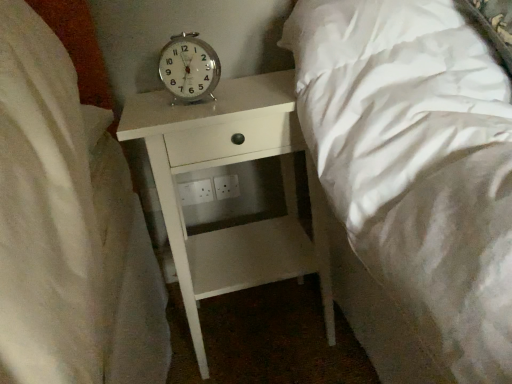
Question: Does metallic silver alarm clock at center have a lesser width compared to white matte nightstand at center?

Choices:
 (A) yes
 (B) no

Answer: (A)

Question: Does metallic silver alarm clock at center have a greater width compared to white matte nightstand at center?

Choices:
 (A) no
 (B) yes

Answer: (A)

Question: Is metallic silver alarm clock at center far from white matte nightstand at center?

Choices:
 (A) no
 (B) yes

Answer: (A)

Question: From the image's perspective, is metallic silver alarm clock at center beneath white matte nightstand at center?

Choices:
 (A) yes
 (B) no

Answer: (B)

Question: Is white matte nightstand at center inside metallic silver alarm clock at center?

Choices:
 (A) no
 (B) yes

Answer: (A)

Question: Is metallic silver alarm clock at center oriented towards white matte nightstand at center?

Choices:
 (A) no
 (B) yes

Answer: (A)

Question: Is white matte nightstand at center not within metallic silver alarm clock at center?

Choices:
 (A) yes
 (B) no

Answer: (A)

Question: Considering the relative sizes of white matte nightstand at center and metallic silver alarm clock at center in the image provided, is white matte nightstand at center taller than metallic silver alarm clock at center?

Choices:
 (A) yes
 (B) no

Answer: (A)

Question: Is white matte nightstand at center directly adjacent to metallic silver alarm clock at center?

Choices:
 (A) no
 (B) yes

Answer: (A)

Question: Is white matte nightstand at center aimed at metallic silver alarm clock at center?

Choices:
 (A) yes
 (B) no

Answer: (B)

Question: From a real-world perspective, is white matte nightstand at center over metallic silver alarm clock at center?

Choices:
 (A) yes
 (B) no

Answer: (B)

Question: From a real-world perspective, is white matte nightstand at center below metallic silver alarm clock at center?

Choices:
 (A) no
 (B) yes

Answer: (B)

Question: In the image, is white matte nightstand at center on the left side or the right side of metallic silver alarm clock at center?

Choices:
 (A) right
 (B) left

Answer: (A)